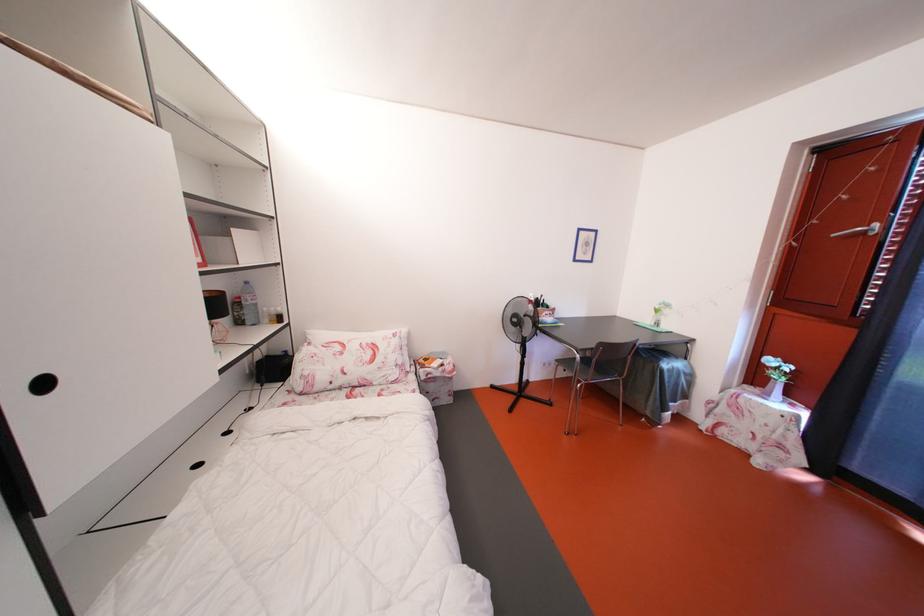
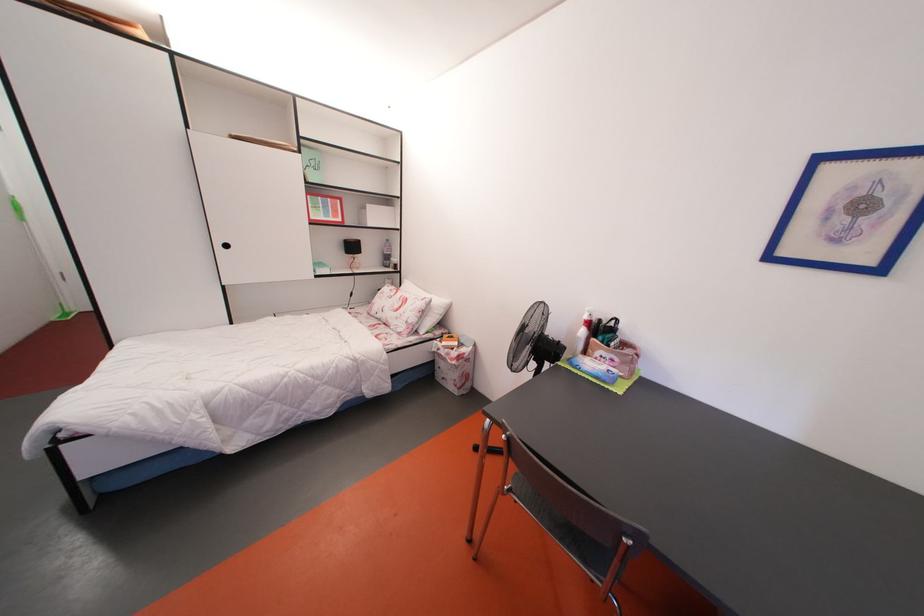
Where in the second image is the point corresponding to the point at 444,379 from the first image?

(450, 360)